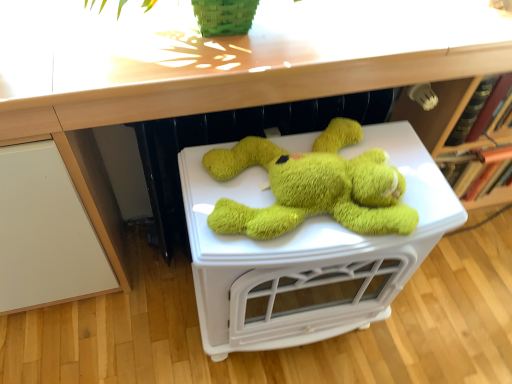
Question: Can you confirm if wooden at upper center is thinner than soft green plush toy at center?

Choices:
 (A) yes
 (B) no

Answer: (B)

Question: Is wooden at upper center closer to camera compared to soft green plush toy at center?

Choices:
 (A) yes
 (B) no

Answer: (A)

Question: From a real-world perspective, does wooden at upper center stand above soft green plush toy at center?

Choices:
 (A) no
 (B) yes

Answer: (B)

Question: Is wooden at upper center not close to soft green plush toy at center?

Choices:
 (A) yes
 (B) no

Answer: (B)

Question: Is wooden at upper center taller than soft green plush toy at center?

Choices:
 (A) no
 (B) yes

Answer: (A)

Question: From the image's perspective, is wooden at upper center below soft green plush toy at center?

Choices:
 (A) yes
 (B) no

Answer: (B)

Question: From the image's perspective, does soft green plush toy at center appear lower than wooden at upper center?

Choices:
 (A) yes
 (B) no

Answer: (A)

Question: Is soft green plush toy at center not inside wooden at upper center?

Choices:
 (A) no
 (B) yes

Answer: (B)

Question: Could you tell me if soft green plush toy at center is turned towards wooden at upper center?

Choices:
 (A) yes
 (B) no

Answer: (B)

Question: Can you confirm if soft green plush toy at center is bigger than wooden at upper center?

Choices:
 (A) no
 (B) yes

Answer: (B)

Question: Is soft green plush toy at center at the right side of wooden at upper center?

Choices:
 (A) no
 (B) yes

Answer: (A)

Question: Considering the relative sizes of soft green plush toy at center and wooden at upper center in the image provided, is soft green plush toy at center shorter than wooden at upper center?

Choices:
 (A) yes
 (B) no

Answer: (B)

Question: Is soft green plush toy at center situated inside wooden at upper center or outside?

Choices:
 (A) inside
 (B) outside

Answer: (B)